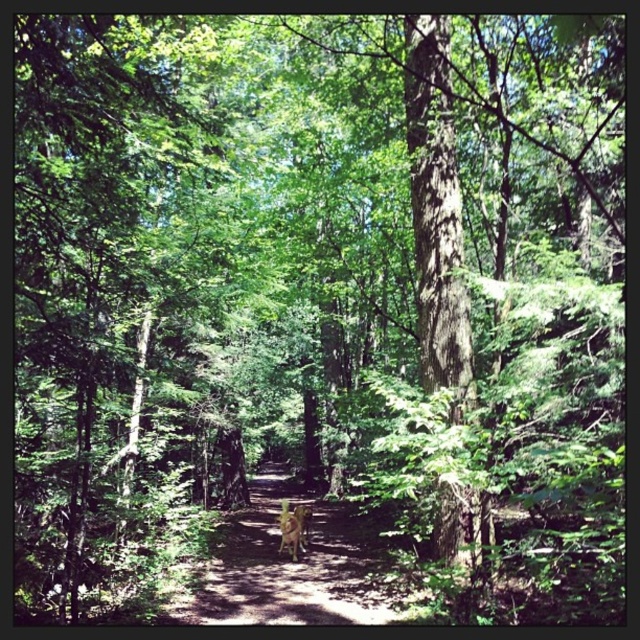
You are a hiker who wants to sit down for a rest. You see a brown textured path at center and a brown wooden bench at center. Which one is higher and therefore a better option for sitting?

The brown wooden bench at center is shorter than the brown textured path at center, so the bench is a better option for sitting since it is lower to the ground.

You are standing at the entrance of the forest and see the brown textured path at center. If you want to reach the path, which direction should you walk towards?

Since the brown textured path at center is located at coordinates point (289, 566), you should walk towards the center of the image to reach it.